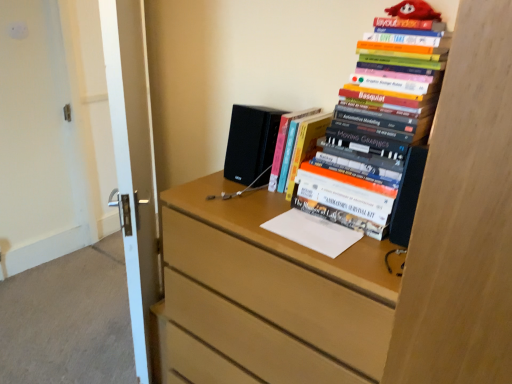
This screenshot has width=512, height=384. I want to click on vacant area that is in front of black matte speaker at center, so click(x=239, y=198).